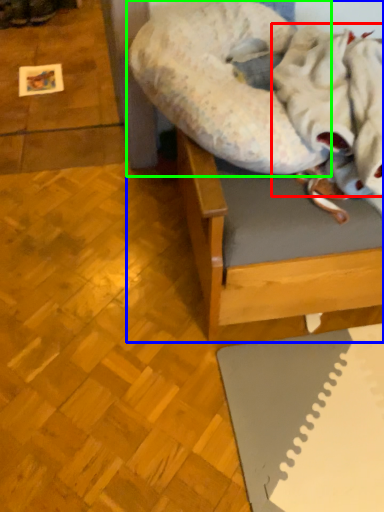
Question: Which object is positioned farthest from blanket (highlighted by a red box)? Select from furniture (highlighted by a blue box) and dog bed (highlighted by a green box).

Choices:
 (A) furniture
 (B) dog bed

Answer: (A)